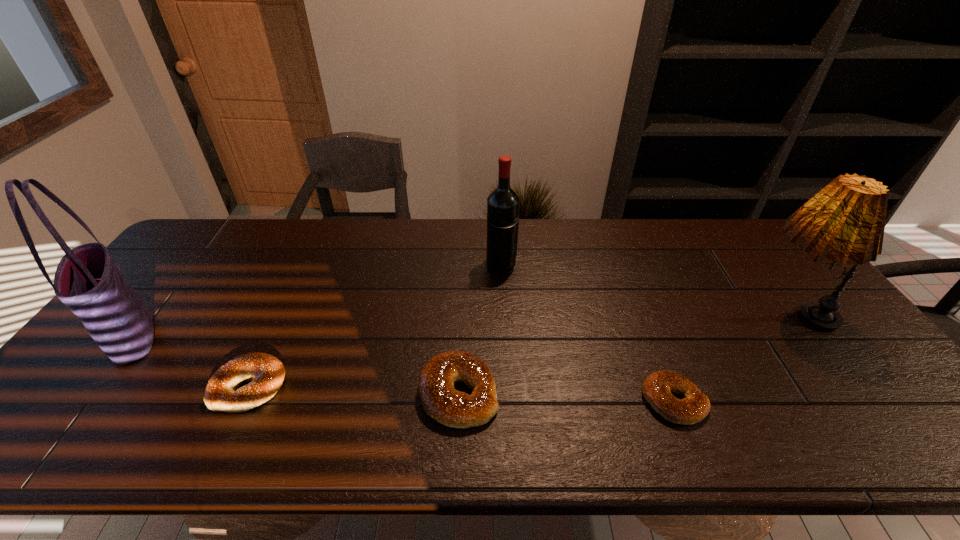
The height and width of the screenshot is (540, 960). In order to click on vacant area that lies between the wine bottle and the fifth object from right to left in this screenshot , I will do `click(375, 325)`.

This screenshot has width=960, height=540. I want to click on vacant space that is in between the rightmost bagel and the farthest object, so click(588, 333).

Where is `free point between the wine bottle and the rightmost object`? The image size is (960, 540). free point between the wine bottle and the rightmost object is located at coordinates (645, 288).

Identify the location of vacant space that is in between the farthest object and the rightmost object. This screenshot has height=540, width=960. (645, 288).

Where is `free space between the leftmost object and the leftmost bagel`? free space between the leftmost object and the leftmost bagel is located at coordinates (191, 361).

The image size is (960, 540). What are the coordinates of `object that is the closest one to the tote bag` in the screenshot? It's located at (266, 372).

The image size is (960, 540). Find the location of `object that is the third closest to the shortest object`. object that is the third closest to the shortest object is located at coordinates pos(503,202).

Point out which bagel is positioned as the second nearest to the second bagel from right to left. Please provide its 2D coordinates. Your answer should be formatted as a tuple, i.e. [(x, y)], where the tuple contains the x and y coordinates of a point satisfying the conditions above.

[(657, 387)]

Identify which bagel is the closest to the leftmost bagel. Please provide its 2D coordinates. Your answer should be formatted as a tuple, i.e. [(x, y)], where the tuple contains the x and y coordinates of a point satisfying the conditions above.

[(441, 401)]

Find the location of a particular element. The width and height of the screenshot is (960, 540). vacant area in the image that satisfies the following two spatial constraints: 1. on the front side of the second shortest object; 2. on the left side of the shortest object is located at coordinates (242, 401).